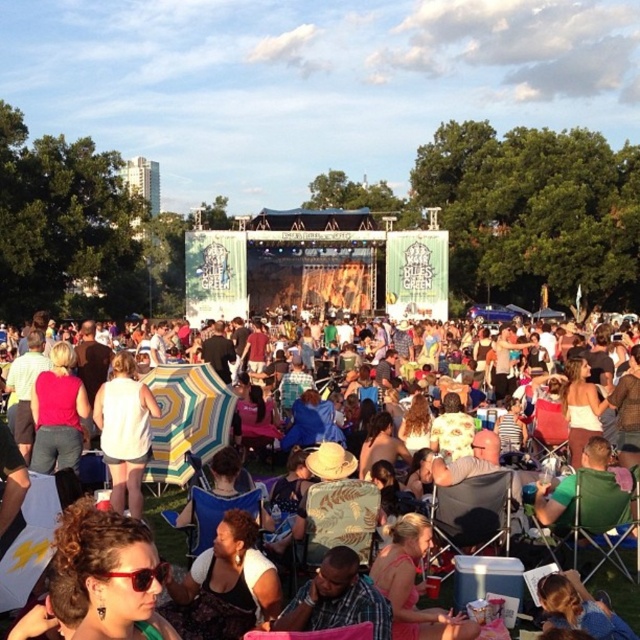
Does green leaf-patterned fabric chair at center have a smaller size compared to green fabric chair at lower right?

Yes, green leaf-patterned fabric chair at center is smaller than green fabric chair at lower right.

Could you measure the distance between green leaf-patterned fabric chair at center and green fabric chair at lower right?

27.53 meters

Is point (320, 499) positioned behind point (573, 529)?

That is False.

Image resolution: width=640 pixels, height=640 pixels. Find the location of `green leaf-patterned fabric chair at center`. green leaf-patterned fabric chair at center is located at coordinates (336, 522).

Does point (113, 481) come in front of point (134, 570)?

No, it is behind (134, 570).

Measure the distance between white matte dress at center and red plastic sunglasses at lower left.

The distance of white matte dress at center from red plastic sunglasses at lower left is 24.44 meters.

Describe the element at coordinates (124, 432) in the screenshot. The width and height of the screenshot is (640, 640). I see `white matte dress at center` at that location.

The width and height of the screenshot is (640, 640). In order to click on white matte dress at center in this screenshot , I will do `click(124, 432)`.

Is white matte dress at center shorter than green fabric chair at lower right?

No.

At what (x,y) coordinates should I click in order to perform the action: click on white matte dress at center. Please return your answer as a coordinate pair (x, y). Looking at the image, I should click on (124, 432).